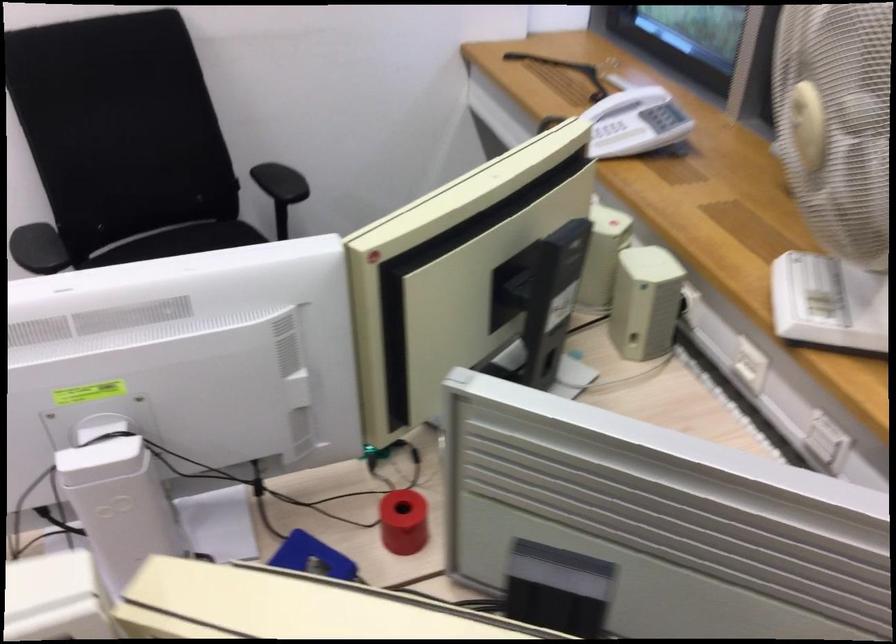
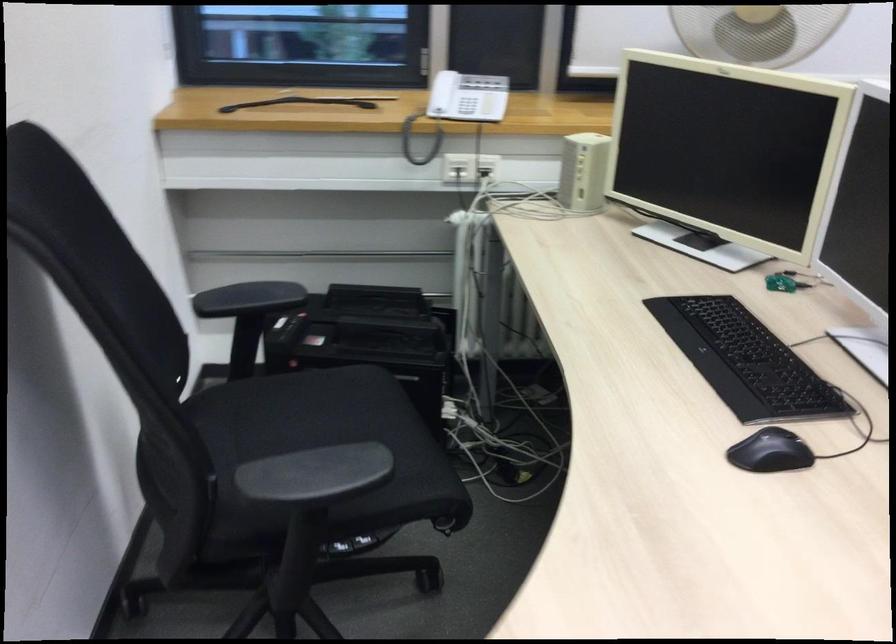
Where in the second image is the point corresponding to point (295, 191) from the first image?

(247, 299)